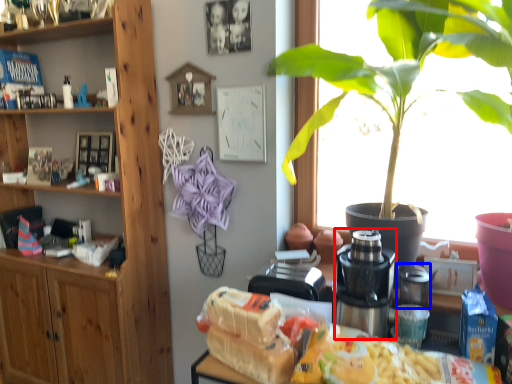
Question: Which object appears farthest to the camera in this image, coffee machine (highlighted by a red box) or appliance (highlighted by a blue box)?

Choices:
 (A) coffee machine
 (B) appliance

Answer: (B)